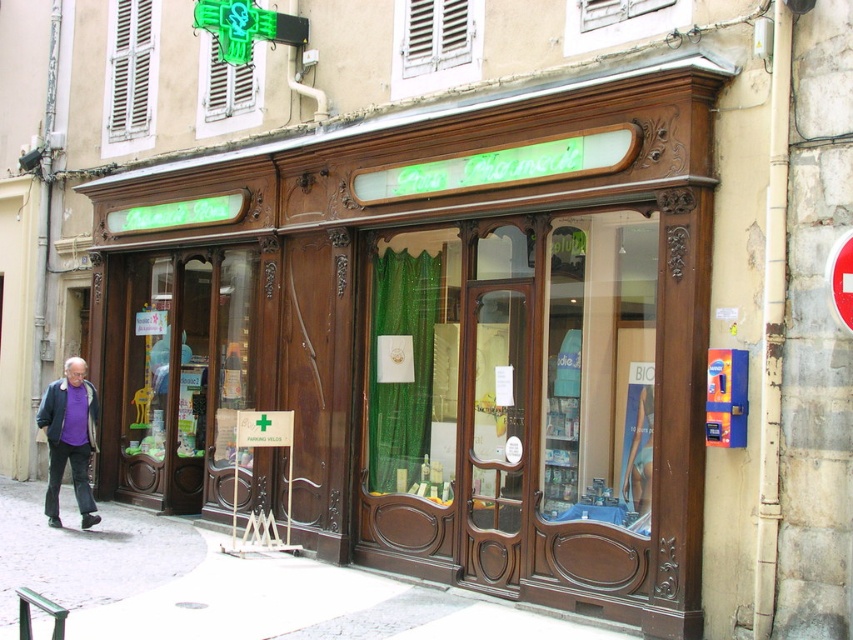
You are a customer entering the pharmacy and see the green fabric curtains at center and the purple soft fabric jacket at lower left. Which item is positioned higher in the store?

The green fabric curtains at center is positioned higher than the purple soft fabric jacket at lower left.

You are a delivery person standing at the entrance of the pharmacy. You need to place a heavy box on the white concrete pavement at lower center without blocking the green fabric curtains at center. Is this possible?

The green fabric curtains at center is above the white concrete pavement at lower center, so placing the box on the pavement won let it block the curtains since they are positioned above.

You are a customer entering the pharmacy and notice the green fabric curtains at center and the purple soft fabric jacket at lower left. Which object is taller?

The green fabric curtains at center is taller than the purple soft fabric jacket at lower left.